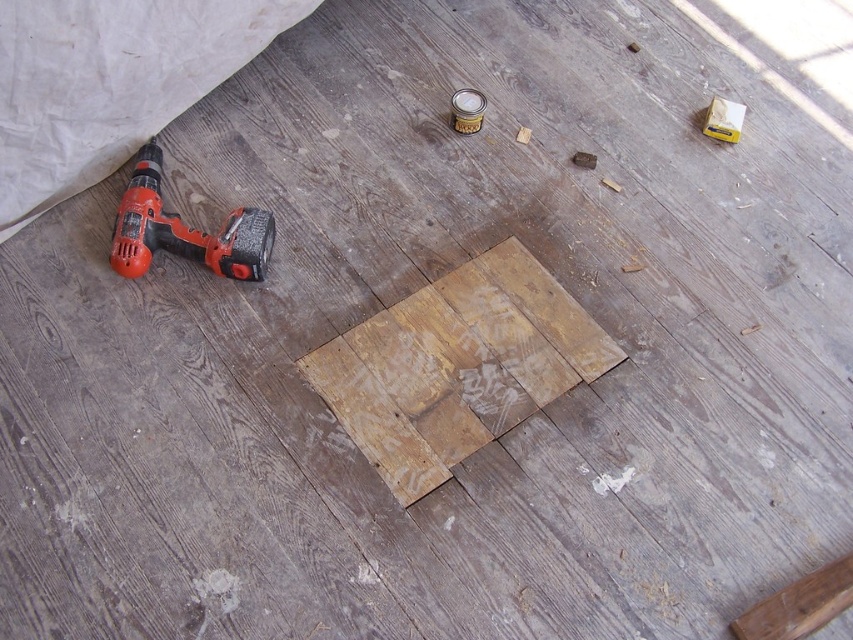
Question: Is weathered wood plank at center below orange plastic drill at lower left?

Choices:
 (A) no
 (B) yes

Answer: (B)

Question: Which of the following is the farthest from the observer?

Choices:
 (A) (550, 332)
 (B) (172, 252)

Answer: (A)

Question: Which of the following is the farthest from the observer?

Choices:
 (A) (143, 240)
 (B) (454, 308)

Answer: (B)

Question: Which point is farther from the camera taking this photo?

Choices:
 (A) (141, 193)
 (B) (515, 300)

Answer: (B)

Question: Does weathered wood plank at center have a lesser width compared to orange plastic drill at lower left?

Choices:
 (A) yes
 (B) no

Answer: (B)

Question: Can you confirm if weathered wood plank at center is positioned above orange plastic drill at lower left?

Choices:
 (A) yes
 (B) no

Answer: (B)